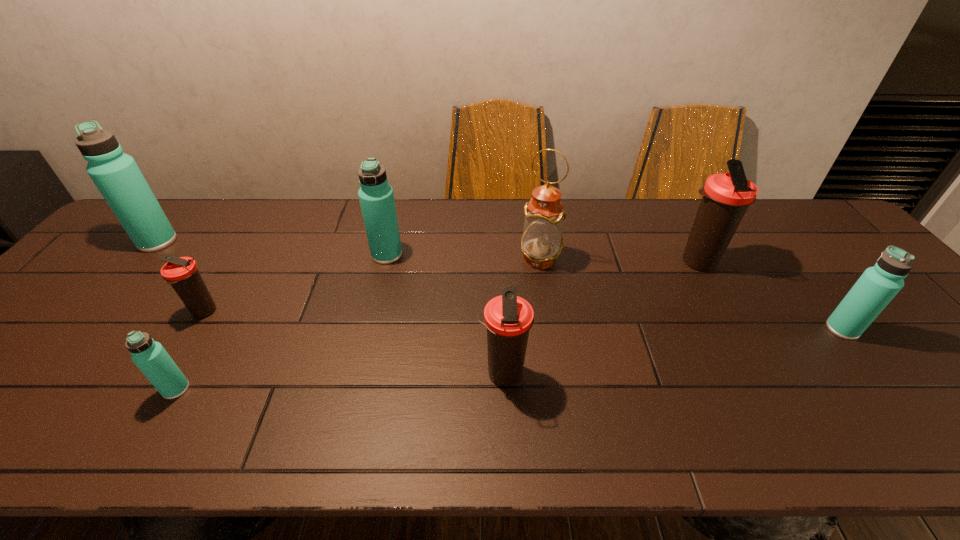
The height and width of the screenshot is (540, 960). What are the coordinates of `the rightmost object` in the screenshot? It's located at click(x=878, y=285).

Find the location of `the second farthest brown thermos bottle`. the second farthest brown thermos bottle is located at coordinates (181, 273).

Find the location of a particular element. the leftmost brown thermos bottle is located at coordinates (181, 273).

This screenshot has width=960, height=540. What are the coordinates of `the second aqua thermos bottle from left to right` in the screenshot? It's located at (149, 356).

Locate an element on the screen. the nearest aqua thermos bottle is located at coordinates pyautogui.click(x=149, y=356).

At what (x,y) coordinates should I click in order to perform the action: click on blank space located 0.110m on the right of the biggest aqua thermos bottle. Please return your answer as a coordinate pair (x, y). Looking at the image, I should click on (212, 241).

Find the location of `vacant space located on the front of the oil lamp`. vacant space located on the front of the oil lamp is located at coordinates (547, 303).

Locate an element on the screen. Image resolution: width=960 pixels, height=540 pixels. vacant area situated 0.100m on the right of the fifth object from right to left is located at coordinates (437, 255).

Where is `vacant space located 0.250m on the right of the second object from right to left`? The height and width of the screenshot is (540, 960). vacant space located 0.250m on the right of the second object from right to left is located at coordinates (809, 262).

The width and height of the screenshot is (960, 540). Find the location of `vacant space located 0.130m on the right of the nearest brown thermos bottle`. vacant space located 0.130m on the right of the nearest brown thermos bottle is located at coordinates (586, 374).